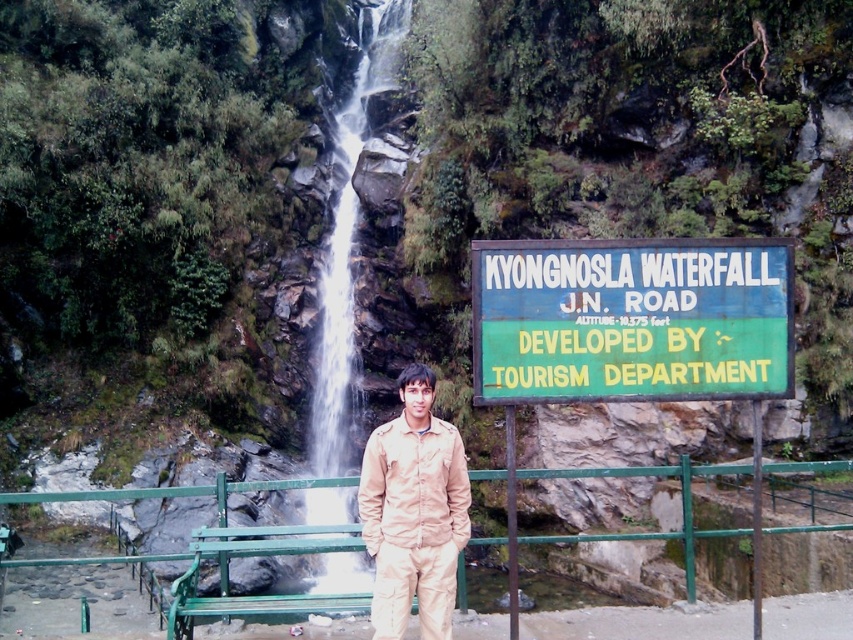
Is point (595, 324) farther from viewer compared to point (282, 525)?

No.

Does green painted sign at right have a lesser width compared to green painted wood park bench at lower center?

Indeed, green painted sign at right has a lesser width compared to green painted wood park bench at lower center.

Where is `green painted sign at right`? green painted sign at right is located at coordinates (631, 320).

Can you confirm if beige fabric jacket at center is smaller than green painted wood park bench at lower center?

Indeed, beige fabric jacket at center has a smaller size compared to green painted wood park bench at lower center.

Is beige fabric jacket at center thinner than green painted wood park bench at lower center?

Correct, beige fabric jacket at center's width is less than green painted wood park bench at lower center's.

Does point (370, 531) come in front of point (234, 596)?

Yes, point (370, 531) is in front of point (234, 596).

Locate an element on the screen. Image resolution: width=853 pixels, height=640 pixels. beige fabric jacket at center is located at coordinates (413, 512).

Does point (515, 284) lie behind point (399, 22)?

No, it is not.

Between green painted sign at right and white smooth water at center, which one is positioned lower?

Positioned lower is green painted sign at right.

Image resolution: width=853 pixels, height=640 pixels. I want to click on green painted sign at right, so click(631, 320).

Identify the location of green painted sign at right. (631, 320).